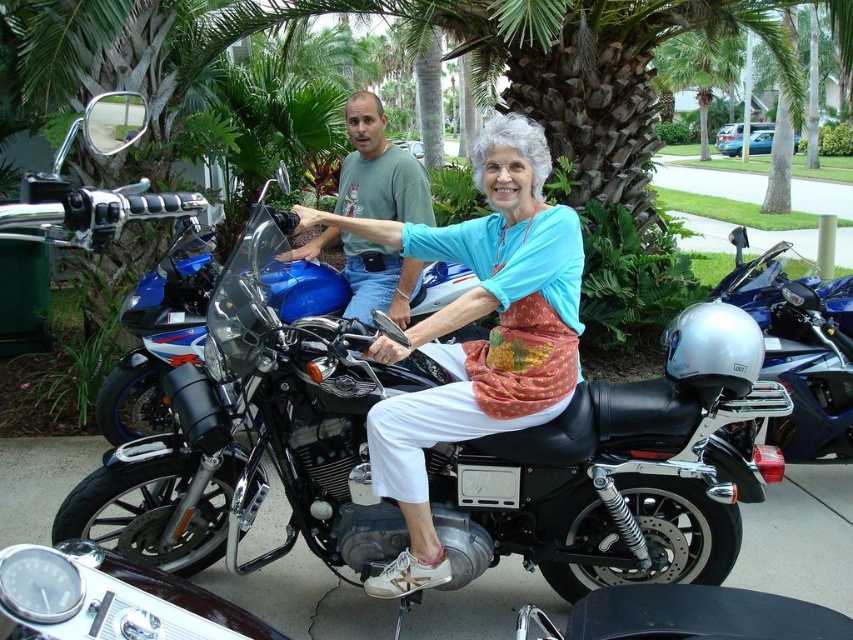
Question: Can you confirm if black matte motorcycle at center is wider than glossy blue motorcycle at center?

Choices:
 (A) yes
 (B) no

Answer: (A)

Question: Which object appears farthest from the camera in this image?

Choices:
 (A) glossy blue motorcycle at center
 (B) black matte motorcycle at center

Answer: (A)

Question: Considering the real-world distances, which object is farthest from the black matte motorcycle at center?

Choices:
 (A) matte blue helmet at upper center
 (B) matte blue helmet at center
 (C) glossy blue motorcycle at center

Answer: (C)

Question: Does matte blue helmet at upper center have a smaller size compared to glossy blue motorcycle at center?

Choices:
 (A) no
 (B) yes

Answer: (A)

Question: Is black matte motorcycle at center above matte blue helmet at center?

Choices:
 (A) yes
 (B) no

Answer: (B)

Question: Which object appears farthest from the camera in this image?

Choices:
 (A) glossy blue motorcycle at center
 (B) matte blue helmet at center
 (C) black matte motorcycle at center
 (D) matte blue helmet at upper center

Answer: (B)